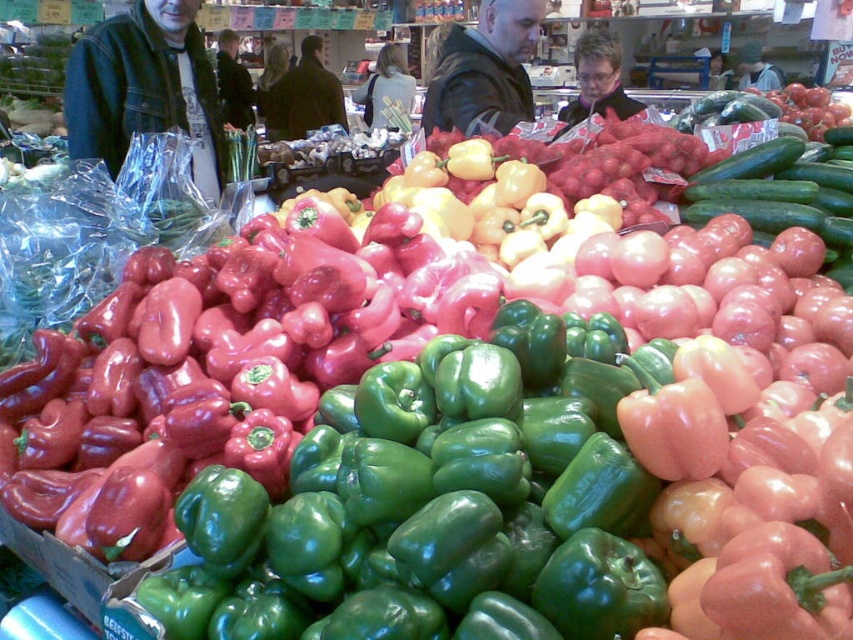
Question: Which of the following is the closest to the observer?

Choices:
 (A) dark blue denim jacket at upper left
 (B) clear plastic bag at center

Answer: (B)

Question: Does clear plastic bag at center appear under dark blue denim jacket at upper left?

Choices:
 (A) yes
 (B) no

Answer: (A)

Question: Based on their relative distances, which object is farther from the dark blue denim jacket at upper left?

Choices:
 (A) clear plastic bag at center
 (B) dark brown jacket at center

Answer: (A)

Question: Does leather jacket at center appear over dark blue denim jacket at upper left?

Choices:
 (A) no
 (B) yes

Answer: (A)

Question: Is the position of clear plastic bag at center more distant than that of denim jacket at center?

Choices:
 (A) no
 (B) yes

Answer: (A)

Question: Among these points, which one is farthest from the camera?

Choices:
 (A) (589, 56)
 (B) (402, 100)

Answer: (B)